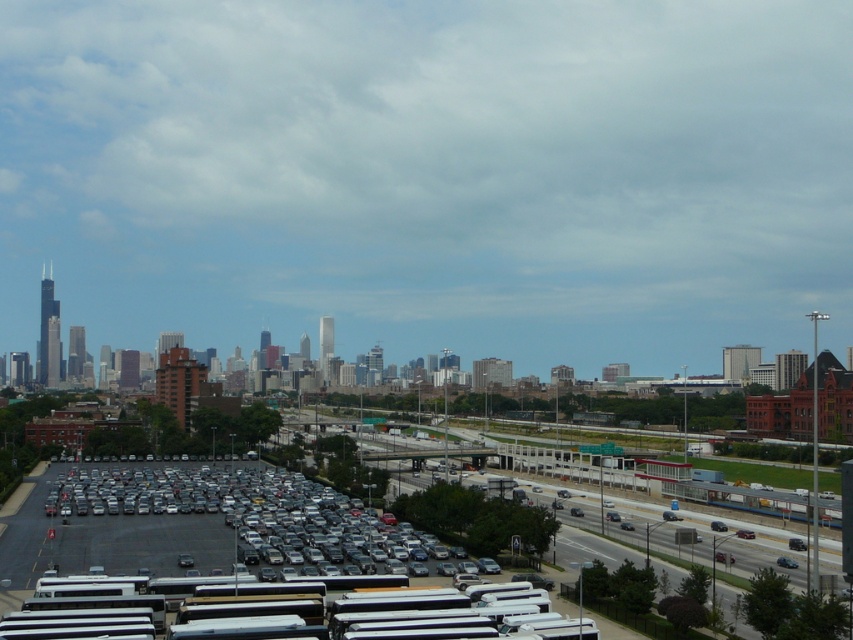
You are a drone operator tasked with capturing aerial footage of the metallic blue sedan at center and the matte silver sedan at center. Since you can only capture one vehicle at a time, which one should you prioritize to ensure it appears in the foreground of your shot?

The metallic blue sedan at center is located above the matte silver sedan at center, so prioritizing the metallic blue sedan at center ensures it appears in the foreground as it is closer to the drone.

You are a pedestrian standing at the edge of the highway. You see a metallic blue sedan at center and a matte silver sedan at center. Which one is closer to you?

The metallic blue sedan at center is closer to you because it is positioned in front of the matte silver sedan at center.

You are a delivery driver who needs to park your vehicle in the parking lot. Your truck is 2 meters tall. The parking lot has two spots available. One is next to the metallic gray cars at lower center and the other is next to the metallic blue sedan at center. Which parking spot would you choose to ensure your truck can fit without hitting the roof?

You should choose the parking spot next to the metallic gray cars at lower center because they are taller than the metallic blue sedan at center, indicating that the height clearance there is sufficient for your 2 meters tall truck.